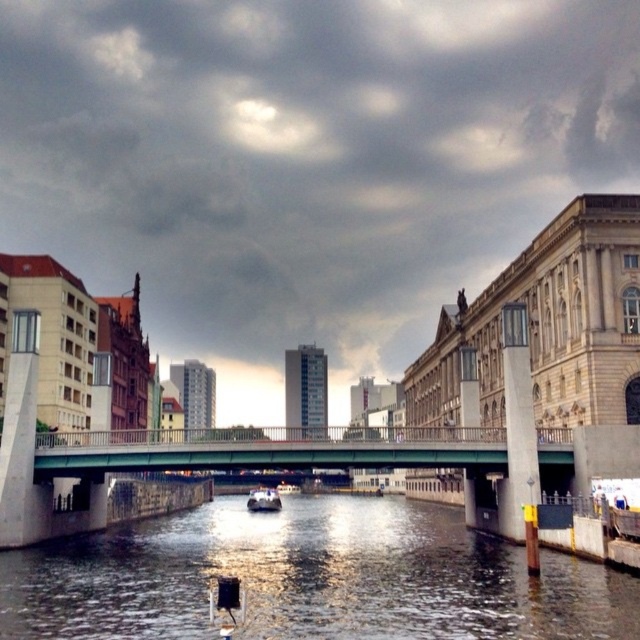
Question: Is shiny dark water at center positioned at the back of white glossy boat at center?

Choices:
 (A) no
 (B) yes

Answer: (A)

Question: Is shiny dark water at center closer to camera compared to green metallic bridge at center?

Choices:
 (A) yes
 (B) no

Answer: (A)

Question: Which point is farther to the camera?

Choices:
 (A) green metallic bridge at center
 (B) white glossy boat at center
 (C) shiny dark water at center

Answer: (B)

Question: Which point is closer to the camera taking this photo?

Choices:
 (A) (305, 611)
 (B) (266, 502)

Answer: (A)

Question: Which is nearer to the green metallic bridge at center?

Choices:
 (A) shiny dark water at center
 (B) white glossy boat at center

Answer: (A)

Question: Does shiny dark water at center have a larger size compared to white glossy boat at center?

Choices:
 (A) yes
 (B) no

Answer: (B)